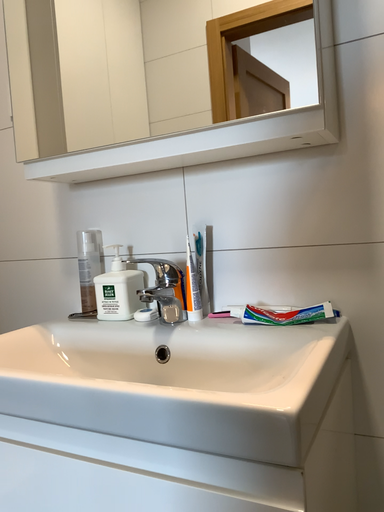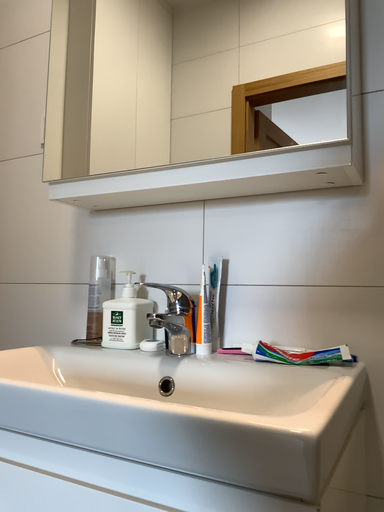
Question: How did the camera likely rotate when shooting the video?

Choices:
 (A) rotated downward
 (B) rotated upward

Answer: (B)